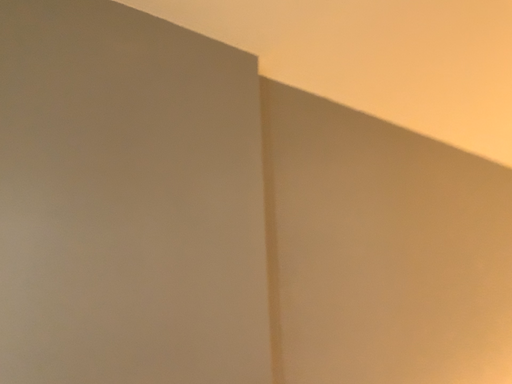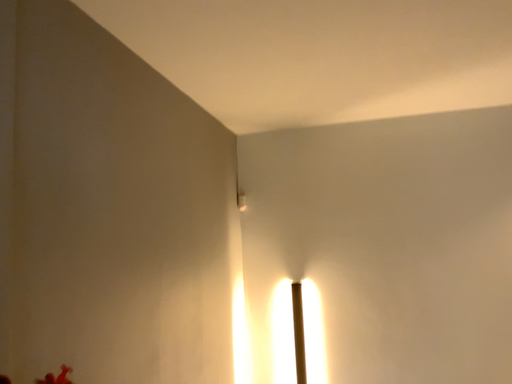
Question: Which way did the camera rotate in the video?

Choices:
 (A) rotated downward
 (B) rotated upward

Answer: (A)